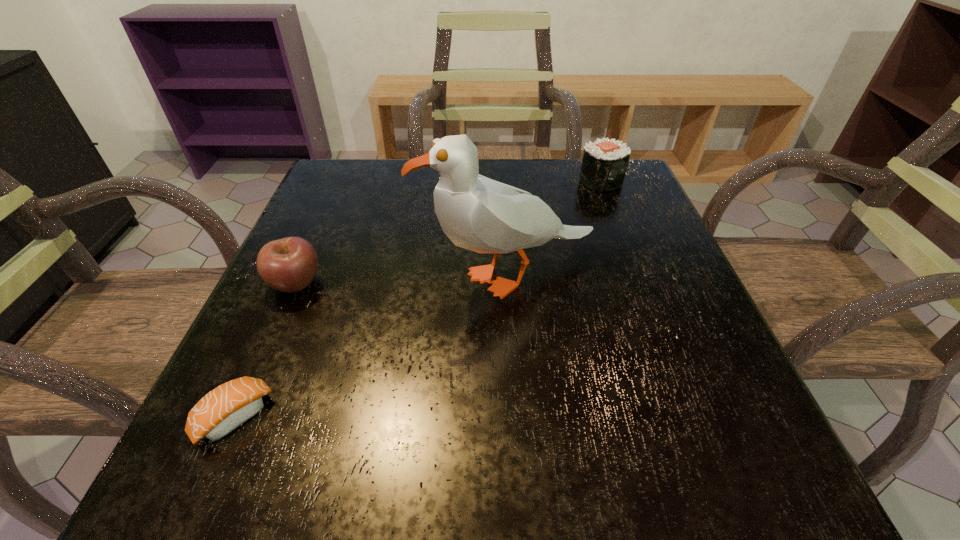
At what (x,y) coordinates should I click in order to perform the action: click on blank area at the far edge. Please return your answer as a coordinate pair (x, y). This screenshot has height=540, width=960. Looking at the image, I should click on (551, 161).

Find the location of `free space at the near edge`. free space at the near edge is located at coordinates (601, 492).

At what (x,y) coordinates should I click in order to perform the action: click on free space at the left edge. Please return your answer as a coordinate pair (x, y). The height and width of the screenshot is (540, 960). Looking at the image, I should click on (248, 333).

In the image, there is a desktop. Find the location of `vacant region at the right edge`. vacant region at the right edge is located at coordinates (663, 364).

In the image, there is a desktop. At what (x,y) coordinates should I click in order to perform the action: click on vacant space at the far right corner. Please return your answer as a coordinate pair (x, y). The height and width of the screenshot is (540, 960). Looking at the image, I should click on (588, 205).

Image resolution: width=960 pixels, height=540 pixels. In the image, there is a desktop. Find the location of `blank space at the near right corner`. blank space at the near right corner is located at coordinates (728, 429).

This screenshot has height=540, width=960. Identify the location of vacant area that lies between the second object from right to left and the apple. (403, 280).

I want to click on unoccupied area between the apple and the gull, so click(x=403, y=280).

The width and height of the screenshot is (960, 540). What are the coordinates of `empty location between the nearest object and the apple` in the screenshot? It's located at (266, 350).

Locate an element on the screen. The height and width of the screenshot is (540, 960). free space between the apple and the tallest object is located at coordinates (x=403, y=280).